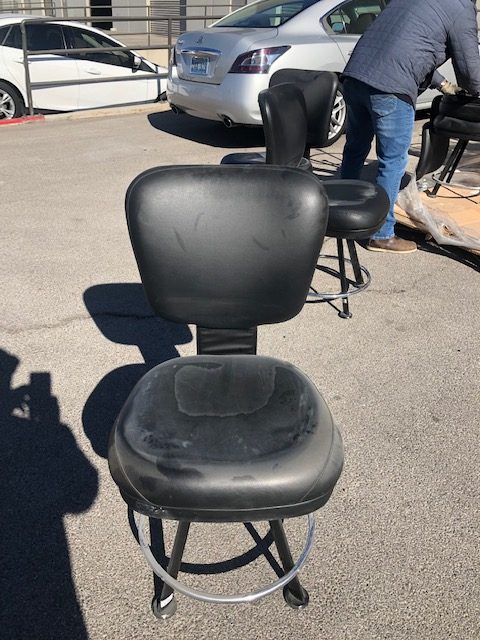
In order to click on back of chair in this screenshot , I will do `click(238, 237)`.